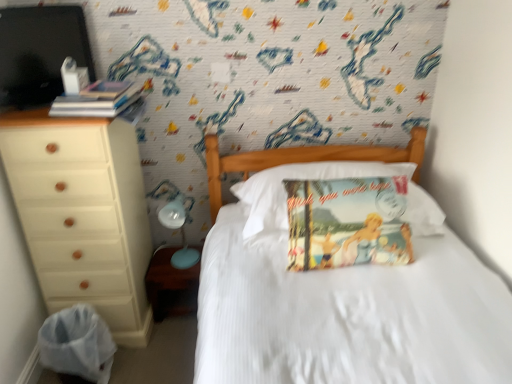
The image size is (512, 384). What do you see at coordinates (347, 223) in the screenshot?
I see `vintage paper pillow at center, which is the second book from left to right` at bounding box center [347, 223].

Locate an element on the screen. hardcover books at left, positioned as the 2th book in bottom-to-top order is located at coordinates (97, 100).

This screenshot has height=384, width=512. What do you see at coordinates (181, 234) in the screenshot? I see `light blue plastic table lamp at lower left` at bounding box center [181, 234].

Identify the location of white satin bed at center. (340, 291).

Find the location of `vintage paper pillow at center`. vintage paper pillow at center is located at coordinates (286, 192).

You are a GUI agent. You are given a task and a screenshot of the screen. Output one action in this format:
    pyautogui.click(x=<x>, y=<y>)
    Task: Click on the matte brown wood at lower left
    
    Given the screenshot: What is the action you would take?
    pyautogui.click(x=170, y=285)

Is vintage paper pillow at center, the 1th book when ordered from bottom to top, in front of or behind vintage paper pillow at center in the image?

vintage paper pillow at center, the 1th book when ordered from bottom to top, is in front of vintage paper pillow at center.

Which object is positioned more to the left, vintage paper pillow at center, the 1th book when ordered from bottom to top, or vintage paper pillow at center?

vintage paper pillow at center is more to the left.

Image resolution: width=512 pixels, height=384 pixels. Identify the location of pillow beneath the vintage paper pillow at center, the first book when ordered from right to left (from a real-world perspective). (286, 192).

In terms of width, does vintage paper pillow at center, which is the second book from left to right, look wider or thinner when compared to vintage paper pillow at center?

vintage paper pillow at center, which is the second book from left to right, is thinner than vintage paper pillow at center.

Is matte brown wood at lower left to the left of hardcover books at left, positioned as the 2th book in bottom-to-top order, from the viewer's perspective?

Incorrect, matte brown wood at lower left is not on the left side of hardcover books at left, positioned as the 2th book in bottom-to-top order.

Is matte brown wood at lower left positioned far away from hardcover books at left, positioned as the 2th book in bottom-to-top order?

No, matte brown wood at lower left is not far away from hardcover books at left, positioned as the 2th book in bottom-to-top order.

From the image's perspective, between matte brown wood at lower left and hardcover books at left, which is the 1th book in top-to-bottom order, which one is located above?

hardcover books at left, which is the 1th book in top-to-bottom order.

Which object is further away from the camera taking this photo, matte brown wood at lower left or hardcover books at left, positioned as the 2th book in bottom-to-top order?

Positioned behind is matte brown wood at lower left.

Between vintage paper pillow at center and matte brown wood at lower left, which one is positioned behind?

matte brown wood at lower left is more distant.

Is vintage paper pillow at center far away from matte brown wood at lower left?

No.

From the image's perspective, between vintage paper pillow at center and matte brown wood at lower left, which one is located above?

From the image's view, vintage paper pillow at center is above.

From a real-world perspective, is vintage paper pillow at center physically above matte brown wood at lower left?

Correct, in the physical world, vintage paper pillow at center is higher than matte brown wood at lower left.

Between beige wood chest of drawers at left and vintage paper pillow at center, which one appears on the left side from the viewer's perspective?

beige wood chest of drawers at left is more to the left.

From the image's perspective, is beige wood chest of drawers at left located beneath vintage paper pillow at center?

Correct, beige wood chest of drawers at left appears lower than vintage paper pillow at center in the image.

Is beige wood chest of drawers at left taller than vintage paper pillow at center?

Correct, beige wood chest of drawers at left is much taller as vintage paper pillow at center.

Is vintage paper pillow at center located within beige wood chest of drawers at left?

No, vintage paper pillow at center is located outside of beige wood chest of drawers at left.

Does hardcover books at left, the second book when ordered from right to left, touch beige wood chest of drawers at left?

No, hardcover books at left, the second book when ordered from right to left, is not next to beige wood chest of drawers at left.

Considering the sizes of objects hardcover books at left, which is the 1th book in top-to-bottom order, and beige wood chest of drawers at left in the image provided, who is wider, hardcover books at left, which is the 1th book in top-to-bottom order, or beige wood chest of drawers at left?

beige wood chest of drawers at left.

In the image, is hardcover books at left, positioned as the 2th book in bottom-to-top order, on the left side or the right side of beige wood chest of drawers at left?

hardcover books at left, positioned as the 2th book in bottom-to-top order, is to the right of beige wood chest of drawers at left.

Which of these two, hardcover books at left, the second book when ordered from right to left, or beige wood chest of drawers at left, is bigger?

With larger size is beige wood chest of drawers at left.

Is white plastic bag at lower left in front of or behind matte brown wood at lower left in the image?

white plastic bag at lower left is positioned closer to the viewer than matte brown wood at lower left.

Is white plastic bag at lower left wider or thinner than matte brown wood at lower left?

In the image, white plastic bag at lower left appears to be wider than matte brown wood at lower left.

Can you tell me how much white plastic bag at lower left and matte brown wood at lower left differ in facing direction?

90 degrees separate the facing orientations of white plastic bag at lower left and matte brown wood at lower left.

From a real-world perspective, between white plastic bag at lower left and matte brown wood at lower left, who is vertically higher?

white plastic bag at lower left, from a real-world perspective.

The height and width of the screenshot is (384, 512). In order to click on pillow above the white satin bed at center (from a real-world perspective) in this screenshot , I will do (286, 192).

Between white satin bed at center and vintage paper pillow at center, which one is positioned behind?

vintage paper pillow at center is behind.

Is white satin bed at center thinner than vintage paper pillow at center?

No, white satin bed at center is not thinner than vintage paper pillow at center.

Between white satin bed at center and vintage paper pillow at center, which one has smaller size?

Smaller between the two is vintage paper pillow at center.

Find the location of `pillow above the vintage paper pillow at center, the 1th book when ordered from bottom to top (from the image's perspective)`. pillow above the vintage paper pillow at center, the 1th book when ordered from bottom to top (from the image's perspective) is located at coordinates (286, 192).

Identify the location of the 2nd book positioned above the matte brown wood at lower left (from a real-world perspective). This screenshot has width=512, height=384. (97, 100).

Considering their positions, is hardcover books at left, the 1th book in the left-to-right sequence, positioned further to vintage paper pillow at center than beige wood chest of drawers at left?

The object further to vintage paper pillow at center is hardcover books at left, the 1th book in the left-to-right sequence.

Considering their positions, is light blue plastic table lamp at lower left positioned closer to beige wood chest of drawers at left than hardcover books at left, which is the 1th book in top-to-bottom order?

The object closer to beige wood chest of drawers at left is hardcover books at left, which is the 1th book in top-to-bottom order.

Looking at the image, which one is located further to hardcover books at left, which is the 1th book in top-to-bottom order, beige wood chest of drawers at left or matte brown wood at lower left?

matte brown wood at lower left.

Looking at the image, which one is located further to white plastic bag at lower left, white satin bed at center or vintage paper pillow at center, the 2th book in the top-to-bottom sequence?

vintage paper pillow at center, the 2th book in the top-to-bottom sequence, is positioned further to the anchor white plastic bag at lower left.

When comparing their distances from beige wood chest of drawers at left, does hardcover books at left, which is the 1th book in top-to-bottom order, or matte brown wood at lower left seem further?

hardcover books at left, which is the 1th book in top-to-bottom order, is positioned further to the anchor beige wood chest of drawers at left.

Which object lies nearer to the anchor point hardcover books at left, which is the 1th book in top-to-bottom order, white satin bed at center or matte brown wood at lower left?

white satin bed at center is positioned closer to the anchor hardcover books at left, which is the 1th book in top-to-bottom order.

Considering their positions, is matte brown wood at lower left positioned closer to vintage paper pillow at center, the 2th book in the top-to-bottom sequence, than vintage paper pillow at center?

vintage paper pillow at center lies closer to vintage paper pillow at center, the 2th book in the top-to-bottom sequence, than the other object.

Based on their spatial positions, is white satin bed at center or vintage paper pillow at center, the 1th book when ordered from bottom to top, closer to matte brown wood at lower left?

Based on the image, white satin bed at center appears to be nearer to matte brown wood at lower left.

Find the location of `table lamp situated between white plastic bag at lower left and vintage paper pillow at center, the first book when ordered from right to left, from left to right`. table lamp situated between white plastic bag at lower left and vintage paper pillow at center, the first book when ordered from right to left, from left to right is located at coordinates (181, 234).

This screenshot has height=384, width=512. In order to click on book located between beige wood chest of drawers at left and vintage paper pillow at center, the first book when ordered from right to left, in the left-right direction in this screenshot , I will do `click(97, 100)`.

This screenshot has width=512, height=384. Identify the location of table lamp between beige wood chest of drawers at left and white plastic bag at lower left from top to bottom. (181, 234).

Identify the location of bed between beige wood chest of drawers at left and vintage paper pillow at center, the 2th book in the top-to-bottom sequence. The width and height of the screenshot is (512, 384). (340, 291).